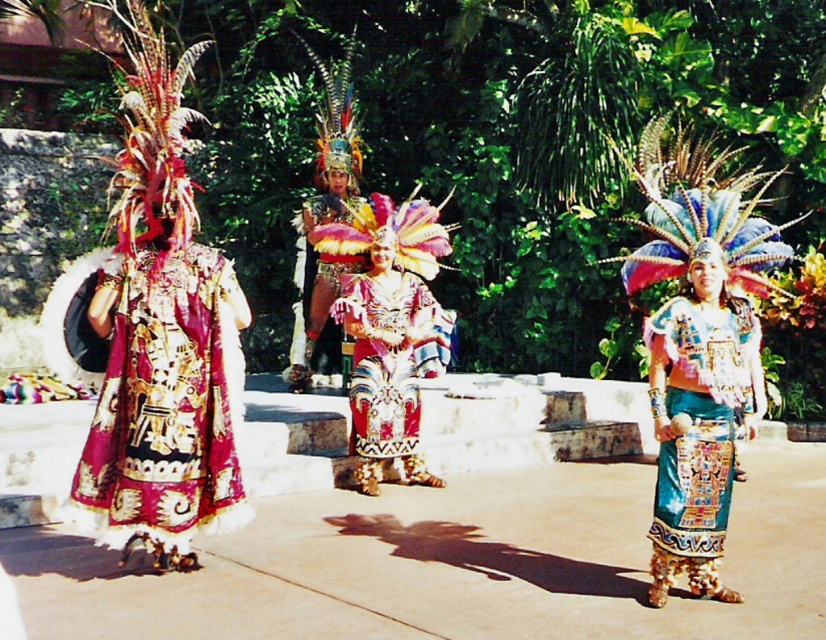
Measure the distance from rich velvet dress at left to shiny metallic costume at center.

A distance of 2.01 meters exists between rich velvet dress at left and shiny metallic costume at center.

Is rich velvet dress at left to the right of shiny metallic costume at center from the viewer's perspective?

In fact, rich velvet dress at left is to the left of shiny metallic costume at center.

What do you see at coordinates (165, 401) in the screenshot? The height and width of the screenshot is (640, 826). I see `rich velvet dress at left` at bounding box center [165, 401].

Where is `rich velvet dress at left`? This screenshot has height=640, width=826. rich velvet dress at left is located at coordinates (165, 401).

Who is positioned more to the right, shiny teal skirt at center or shiny metallic costume at center?

From the viewer's perspective, shiny teal skirt at center appears more on the right side.

Who is taller, shiny teal skirt at center or shiny metallic costume at center?

Standing taller between the two is shiny metallic costume at center.

Who is more forward, (x=739, y=344) or (x=397, y=410)?

Point (x=739, y=344) is more forward.

Find the location of a particular element. Image resolution: width=826 pixels, height=640 pixels. shiny teal skirt at center is located at coordinates click(x=699, y=422).

Is rich velvet dress at left to the left of shiny teal skirt at center from the viewer's perspective?

Correct, you'll find rich velvet dress at left to the left of shiny teal skirt at center.

Is point (141, 323) positioned behind point (662, 529)?

Yes, it is behind point (662, 529).

Is point (131, 458) behind point (677, 296)?

No, (131, 458) is closer to viewer.

Locate an element on the screen. rich velvet dress at left is located at coordinates (165, 401).